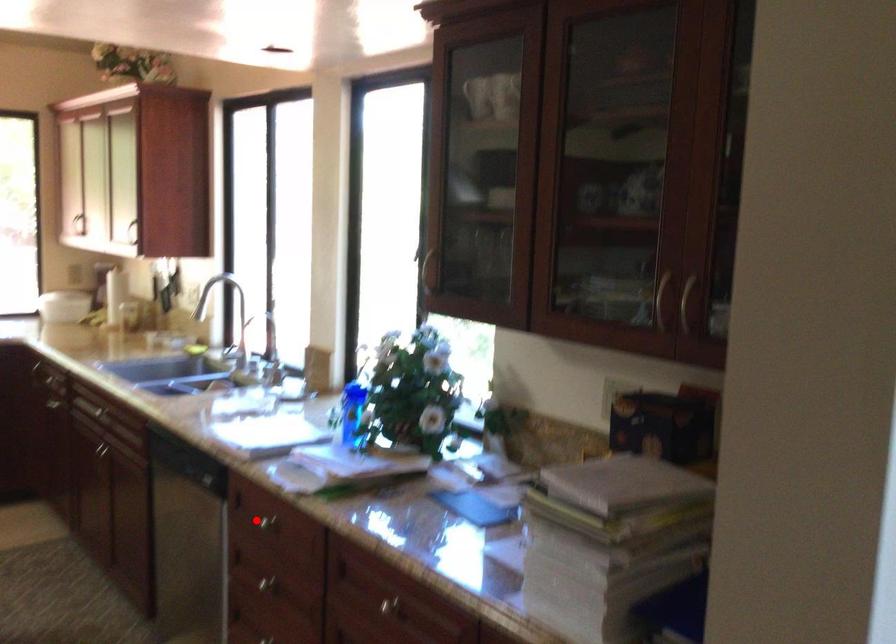
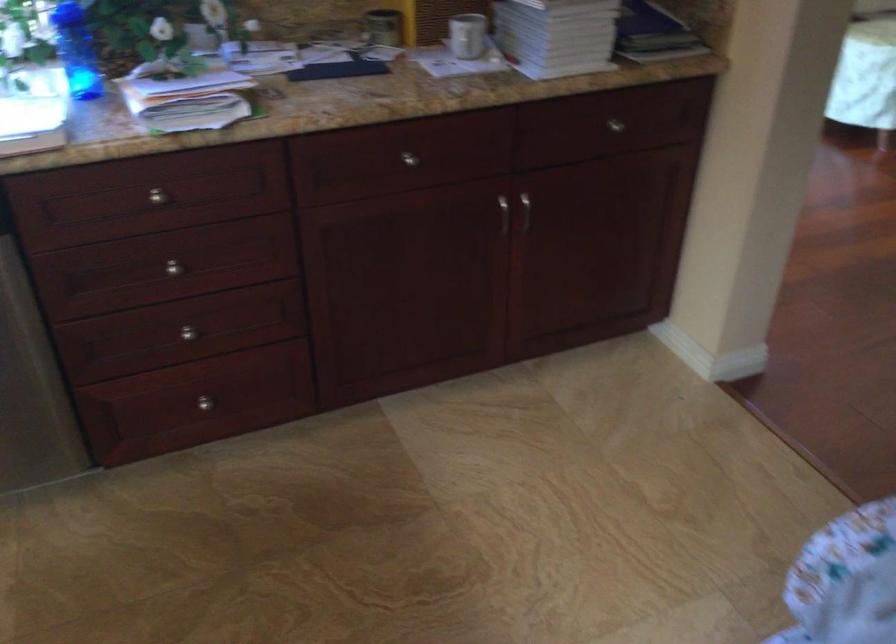
Question: I am providing you with two images of the same scene from different viewpoints. A red point is shown in image1. For the corresponding object point in image2, is it positioned nearer or farther from the camera?

Choices:
 (A) Nearer
 (B) Farther

Answer: (A)